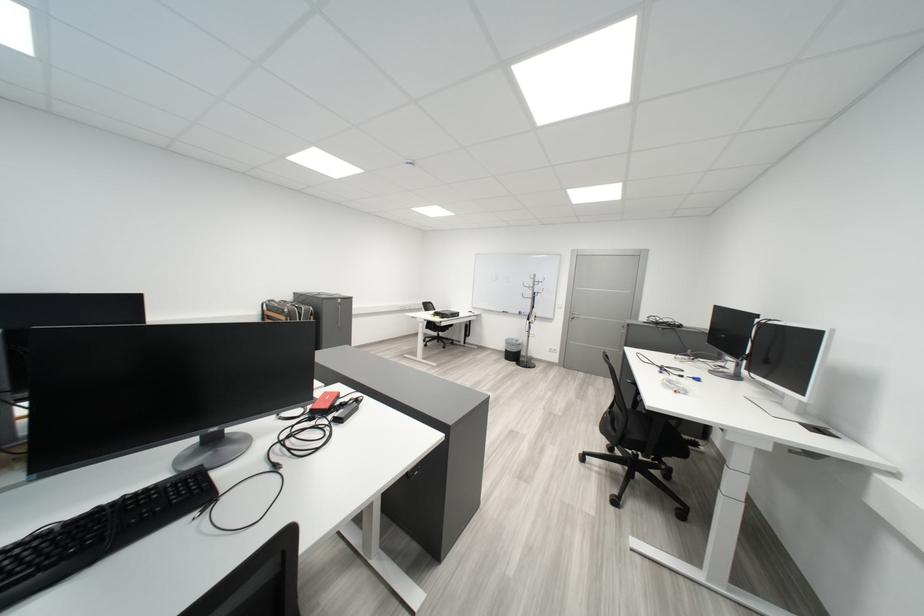
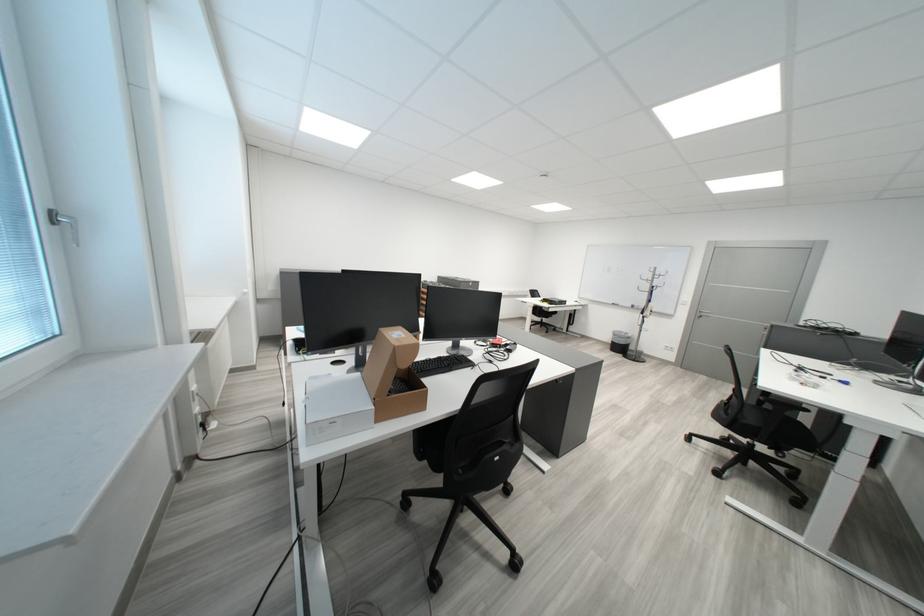
In the second image, find the point that corresponds to pixel 329 415 in the first image.

(507, 347)